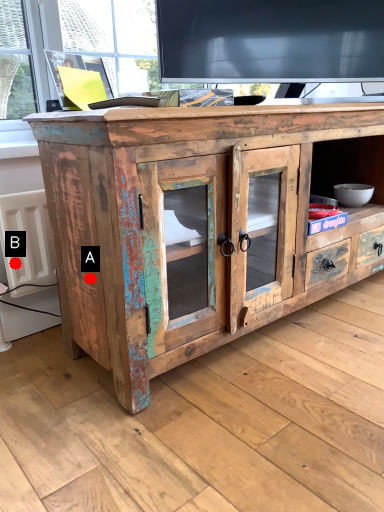
Question: Two points are circled on the image, labeled by A and B beside each circle. Which point is further to the camera?

Choices:
 (A) A is further
 (B) B is further

Answer: (B)